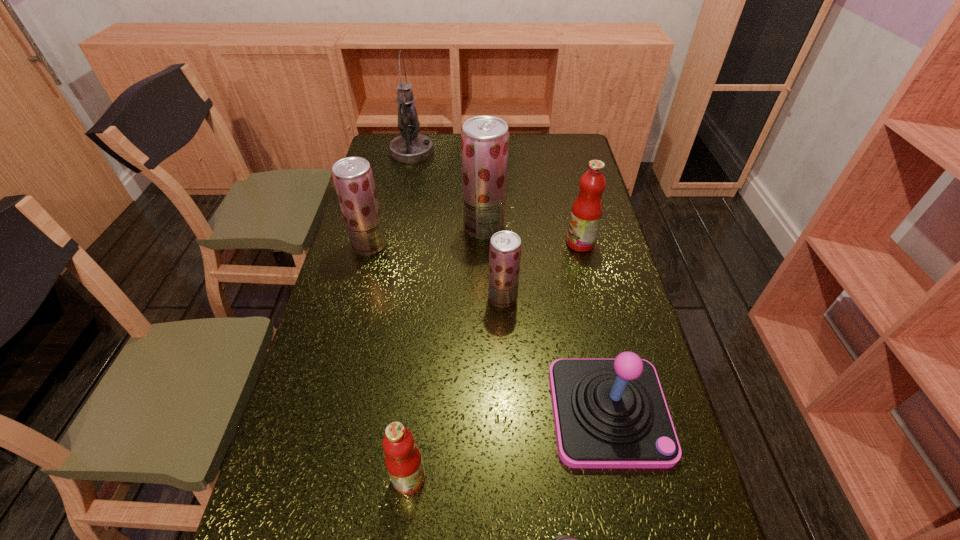
Where is `oil lamp`? This screenshot has width=960, height=540. oil lamp is located at coordinates (410, 147).

You are a GUI agent. You are given a task and a screenshot of the screen. Output one action in this format:
    pyautogui.click(x=<x>, y=<y>)
    Task: Click on the tallest fruit juice
    
    Given the screenshot: What is the action you would take?
    pyautogui.click(x=484, y=139)

Where is `the second smallest strawberry fruit juice`? the second smallest strawberry fruit juice is located at coordinates (353, 178).

Locate an element on the screen. The width and height of the screenshot is (960, 540). the leftmost strawberry fruit juice is located at coordinates (353, 178).

The height and width of the screenshot is (540, 960). I want to click on the farther pink fruit juice, so click(587, 209).

Find the location of `the rightmost fruit juice`. the rightmost fruit juice is located at coordinates (587, 209).

Where is `the second nearest fruit juice`? the second nearest fruit juice is located at coordinates (505, 247).

Find the location of `the fifth farthest object`. the fifth farthest object is located at coordinates (505, 247).

The width and height of the screenshot is (960, 540). What are the coordinates of `the left pink fruit juice` in the screenshot? It's located at (403, 459).

You are a GUI agent. You are given a task and a screenshot of the screen. Output one action in this format:
    pyautogui.click(x=<x>, y=<y>)
    Task: Click on the nearest fruit juice
    The image size is (960, 540).
    Given the screenshot: What is the action you would take?
    403,459